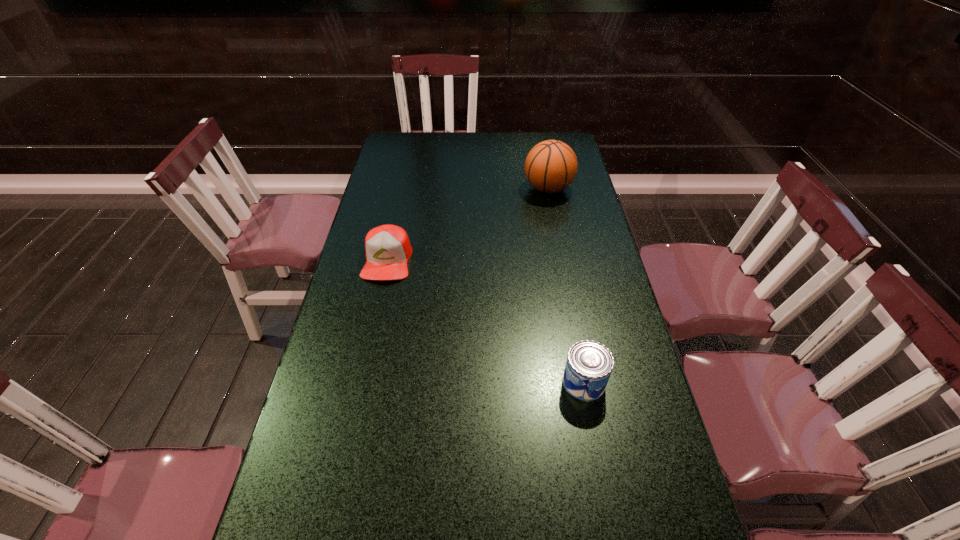
Locate an element on the screen. The width and height of the screenshot is (960, 540). object that is at the left edge is located at coordinates (388, 248).

Where is `basketball at the right edge`? basketball at the right edge is located at coordinates (551, 166).

The image size is (960, 540). Find the location of `can that is positioned at the right edge`. can that is positioned at the right edge is located at coordinates (589, 364).

Locate an element on the screen. Image resolution: width=960 pixels, height=540 pixels. free spot at the far edge of the desktop is located at coordinates (458, 149).

The width and height of the screenshot is (960, 540). I want to click on vacant space at the left edge of the desktop, so click(x=364, y=487).

This screenshot has width=960, height=540. In the image, there is a desktop. In order to click on vacant space at the right edge in this screenshot , I will do `click(579, 183)`.

In order to click on free space at the far left corner of the desktop in this screenshot , I will do `click(399, 155)`.

Where is `free space between the leftmost object and the can`? This screenshot has height=540, width=960. free space between the leftmost object and the can is located at coordinates (486, 321).

Find the location of a particular element. The width and height of the screenshot is (960, 540). vacant space that's between the farthest object and the baseball cap is located at coordinates (468, 224).

What are the coordinates of `free spot between the farthest object and the can` in the screenshot? It's located at (566, 285).